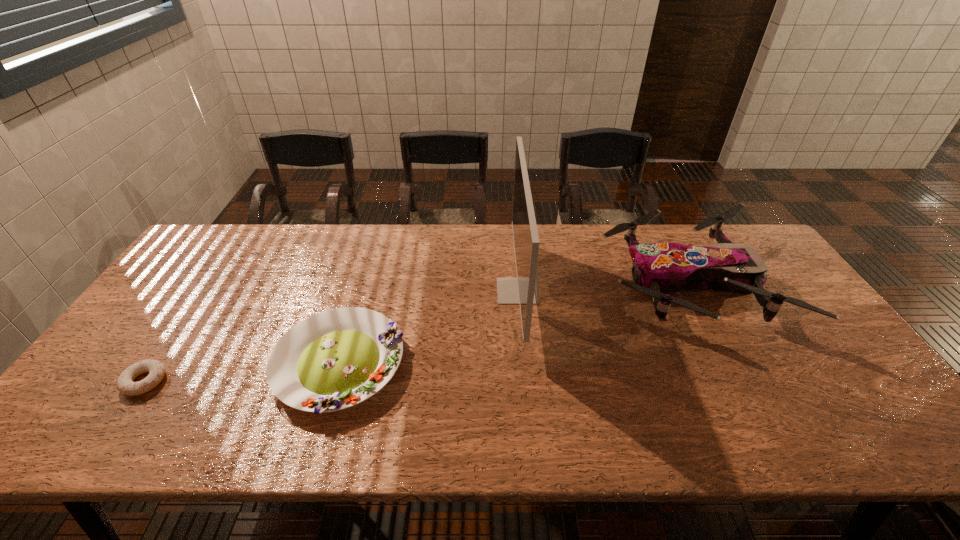
Find the location of a particular element. The height and width of the screenshot is (540, 960). the third object from left to right is located at coordinates (524, 290).

Image resolution: width=960 pixels, height=540 pixels. Find the location of `monitor`. monitor is located at coordinates (524, 290).

Find the location of a particular element. drone is located at coordinates (657, 268).

This screenshot has width=960, height=540. Find the location of `the rightmost object`. the rightmost object is located at coordinates (657, 268).

Where is `the second object from left to right`? the second object from left to right is located at coordinates (335, 359).

I want to click on the second shortest object, so click(335, 359).

Locate an element on the screen. This screenshot has height=540, width=960. the leftmost object is located at coordinates (156, 369).

The height and width of the screenshot is (540, 960). I want to click on doughnut, so click(x=156, y=369).

You are a GUI agent. You are given a task and a screenshot of the screen. Output one action in this format:
    pyautogui.click(x=<x>, y=<y>)
    Task: Click on the free space located on the front-facing side of the third object from left to right
    This screenshot has height=540, width=960.
    Given the screenshot: What is the action you would take?
    pyautogui.click(x=407, y=291)

This screenshot has height=540, width=960. Find the location of `blank space located on the front-facing side of the third object from left to right`. blank space located on the front-facing side of the third object from left to right is located at coordinates (410, 291).